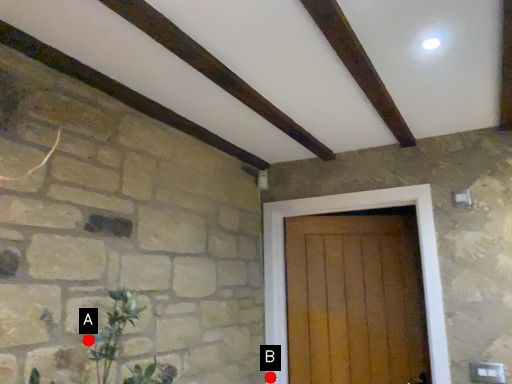
Question: Two points are circled on the image, labeled by A and B beside each circle. Which point appears farthest from the camera in this image?

Choices:
 (A) A is further
 (B) B is further

Answer: (B)